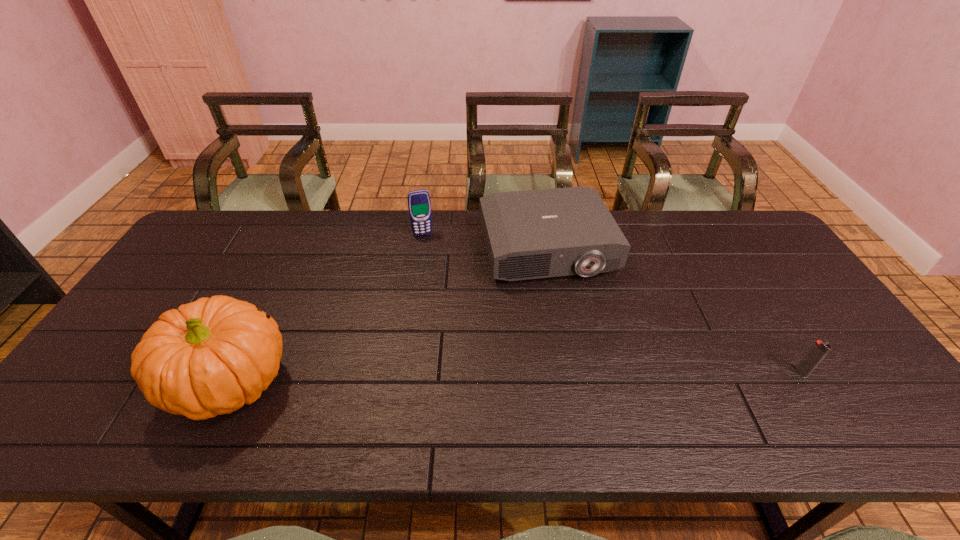
Image resolution: width=960 pixels, height=540 pixels. I want to click on blank area at the far edge, so click(460, 214).

Locate an element on the screen. free space at the near edge of the desktop is located at coordinates (311, 379).

You are a GUI agent. You are given a task and a screenshot of the screen. Output one action in this format:
    pyautogui.click(x=<x>, y=<y>)
    Task: Click on the free spot at the left edge of the desktop
    
    Given the screenshot: What is the action you would take?
    click(x=210, y=264)

At what (x,y) coordinates should I click in order to perform the action: click on free location at the right edge. Please return your answer as a coordinate pair (x, y). The width and height of the screenshot is (960, 540). Looking at the image, I should click on (792, 348).

At what (x,y) coordinates should I click in order to perform the action: click on blank region between the rightmost object and the third shortest object. Please return your answer as a coordinate pair (x, y). Looking at the image, I should click on (612, 303).

The image size is (960, 540). Find the location of `free area in between the leftmost object and the cellular telephone`. free area in between the leftmost object and the cellular telephone is located at coordinates (327, 308).

Locate an element on the screen. This screenshot has height=540, width=960. vacant point located between the second object from left to right and the igniter is located at coordinates (612, 303).

Identify the location of vacant space that is in between the leftmost object and the second object from right to left. The image size is (960, 540). (390, 315).

Where is `free space between the second tallest object and the second object from right to left`? The height and width of the screenshot is (540, 960). free space between the second tallest object and the second object from right to left is located at coordinates (485, 242).

Image resolution: width=960 pixels, height=540 pixels. Find the location of `vacant space in between the rightmost object and the projector`. vacant space in between the rightmost object and the projector is located at coordinates (674, 310).